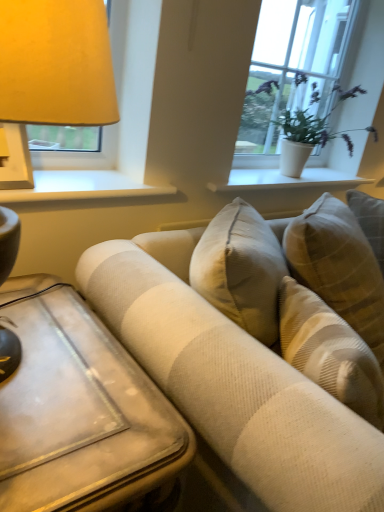
Find the location of `free space above wooden table at lower left (from a real-world perspective)`. free space above wooden table at lower left (from a real-world perspective) is located at coordinates (57, 364).